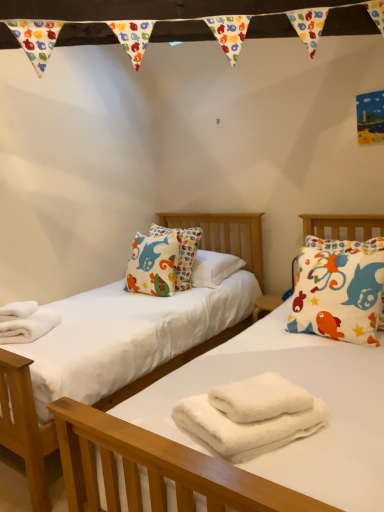
Question: Would you say white fluffy towels at lower left is to the left or to the right of white fluffy towels at center, which is the 1th bath towel in bottom-to-top order, in the picture?

Choices:
 (A) right
 (B) left

Answer: (B)

Question: Would you say white fluffy towels at lower left is inside or outside white fluffy towels at center, the second bath towel when ordered from top to bottom?

Choices:
 (A) outside
 (B) inside

Answer: (A)

Question: Estimate the real-world distances between objects in this image. Which object is closer to the white fluffy towels at center, the second bath towel when ordered from top to bottom?

Choices:
 (A) white cotton pillow with colorful fish at right
 (B) white fluffy towels at lower left
 (C) white fluffy bath towel at center, marked as the second bath towel in a bottom-to-top arrangement

Answer: (C)

Question: Which of these objects is positioned closest to the white cotton pillow with colorful fish at right?

Choices:
 (A) white fluffy bath towel at center, marked as the second bath towel in a bottom-to-top arrangement
 (B) white fluffy towels at center, which is the 1th bath towel in bottom-to-top order
 (C) white fluffy towels at lower left

Answer: (A)